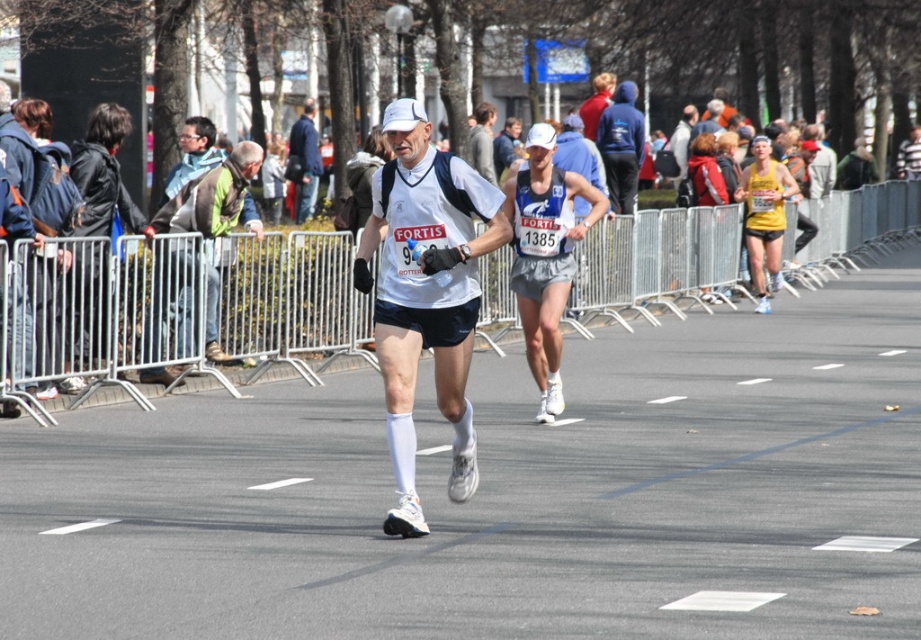
Based on the photo, you are a photographer at the marathon event. You need to capture a photo where both the red jacket at center and the white matte cap at upper center are visible. Based on their sizes in the image, which object should you focus on first to ensure both are in frame?

The red jacket at center is smaller than the white matte cap at upper center, so you should focus on the white matte cap at upper center first to ensure both are in frame.

You are a photographer at the marathon event. You want to take a photo of the two runners, focusing on the point at point (x=76, y=253) and point (x=783, y=216). Which point should you focus on first to ensure the closer one is sharp?

The point closer to the viewer is point (x=76, y=253), so you should focus on that first to ensure it is sharp before the farther point (x=783, y=216).

You are a spectator at the marathon and want to locate the red jacket at center and white matte cap at upper center. Which object is higher up in the image?

The white matte cap at upper center is higher up in the image than the red jacket at center.